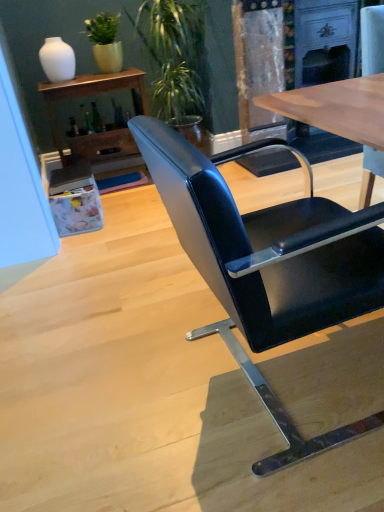
Question: From a real-world perspective, is matte wood shelf at upper left positioned over white glossy vase at upper left based on gravity?

Choices:
 (A) yes
 (B) no

Answer: (B)

Question: Does matte wood shelf at upper left have a smaller size compared to white glossy vase at upper left?

Choices:
 (A) no
 (B) yes

Answer: (A)

Question: Is matte wood shelf at upper left behind white glossy vase at upper left?

Choices:
 (A) yes
 (B) no

Answer: (B)

Question: Can white glossy vase at upper left be found inside matte wood shelf at upper left?

Choices:
 (A) yes
 (B) no

Answer: (B)

Question: Are matte wood shelf at upper left and white glossy vase at upper left making contact?

Choices:
 (A) yes
 (B) no

Answer: (B)

Question: Which is correct: matte wood shelf at upper left is inside green matte plant at upper left, the first houseplant positioned from the left, or outside of it?

Choices:
 (A) outside
 (B) inside

Answer: (A)

Question: Considering the relative positions of matte wood shelf at upper left and green matte plant at upper left, the first houseplant positioned from the left, in the image provided, is matte wood shelf at upper left to the left or to the right of green matte plant at upper left, the first houseplant positioned from the left,?

Choices:
 (A) right
 (B) left

Answer: (B)

Question: Considering their positions, is matte wood shelf at upper left located in front of or behind green matte plant at upper left, the first houseplant positioned from the left?

Choices:
 (A) front
 (B) behind

Answer: (A)

Question: In terms of size, does matte wood shelf at upper left appear bigger or smaller than green matte plant at upper left, the first houseplant positioned from the left?

Choices:
 (A) small
 (B) big

Answer: (B)

Question: Does point (114, 51) appear closer or farther from the camera than point (51, 48)?

Choices:
 (A) closer
 (B) farther

Answer: (B)

Question: From a real-world perspective, is green matte plant at upper left, the first houseplant positioned from the left, physically located above or below white glossy vase at upper left?

Choices:
 (A) below
 (B) above

Answer: (B)

Question: In terms of height, does green matte plant at upper left, placed as the second houseplant when sorted from right to left, look taller or shorter compared to white glossy vase at upper left?

Choices:
 (A) short
 (B) tall

Answer: (B)

Question: Would you say green matte plant at upper left, placed as the second houseplant when sorted from right to left, is to the left or to the right of white glossy vase at upper left in the picture?

Choices:
 (A) right
 (B) left

Answer: (A)

Question: From a real-world perspective, is green matte plant at upper left, the first houseplant positioned from the left, physically located above or below black leather chair at center?

Choices:
 (A) above
 (B) below

Answer: (A)

Question: Looking at the image, does green matte plant at upper left, the first houseplant positioned from the left, seem bigger or smaller compared to black leather chair at center?

Choices:
 (A) big
 (B) small

Answer: (B)